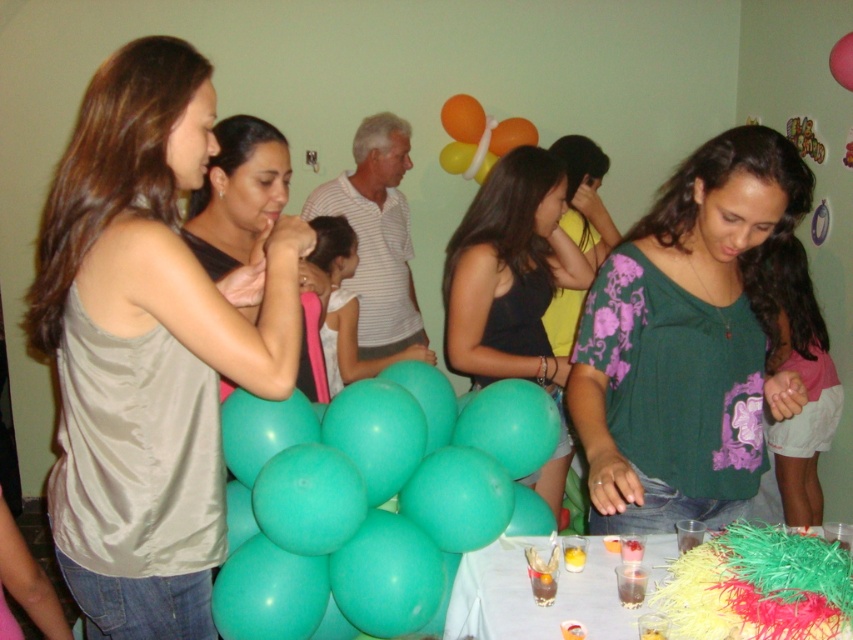
You are at a birthday party and want to greet the person wearing the black satin dress at center. Which direction should you walk to approach them first before reaching the matte black shirt at center?

The black satin dress at center is closer to you than the matte black shirt at center, so you should walk towards the black satin dress at center first as it is already in front of the matte black shirt at center.

You are a guest at this birthday party and want to take a photo of the teal matte balloons at center without the rubber balloon at upper right appearing in the background. Is this possible based on their positions?

Yes, since the teal matte balloons at center are in front of the rubber balloon at upper right, you can position yourself so that the teal matte balloons at center block the view of the rubber balloon at upper right, making it possible to take a photo without the rubber balloon at upper right in the background.